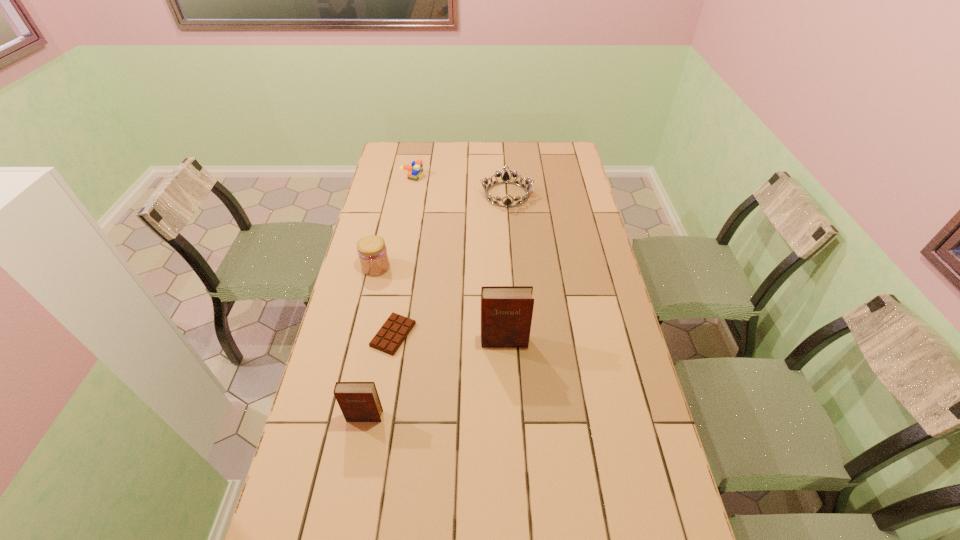
Where is `object situated at the far left corner`? The width and height of the screenshot is (960, 540). object situated at the far left corner is located at coordinates (414, 171).

In the image, there is a desktop. At what (x,y) coordinates should I click in order to perform the action: click on vacant space at the far edge. Please return your answer as a coordinate pair (x, y). Looking at the image, I should click on (503, 158).

Where is `vacant position at the near edge of the desktop`? The image size is (960, 540). vacant position at the near edge of the desktop is located at coordinates (395, 506).

In the image, there is a desktop. Where is `vacant area at the left edge`? The height and width of the screenshot is (540, 960). vacant area at the left edge is located at coordinates (334, 436).

Locate an element on the screen. The image size is (960, 540). vacant space at the right edge of the desktop is located at coordinates (596, 381).

The image size is (960, 540). I want to click on blank space at the far left corner, so click(413, 155).

The height and width of the screenshot is (540, 960). Identify the location of free space between the candy bar and the shorter diary. (379, 375).

Where is `free spot between the candy bar and the tiara`? free spot between the candy bar and the tiara is located at coordinates (450, 265).

Locate an element on the screen. free space between the jam and the shortest object is located at coordinates (385, 301).

Where is `free space between the shortest object and the Lego`? free space between the shortest object and the Lego is located at coordinates (402, 255).